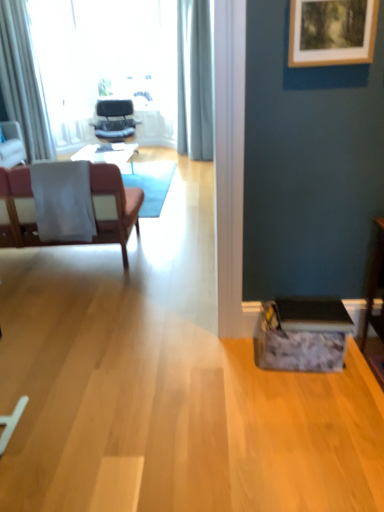
The height and width of the screenshot is (512, 384). Find the location of `vacant area situated below pink fabric chair at left, acting as the first chair starting from the front (from a real-world perspective)`. vacant area situated below pink fabric chair at left, acting as the first chair starting from the front (from a real-world perspective) is located at coordinates (67, 259).